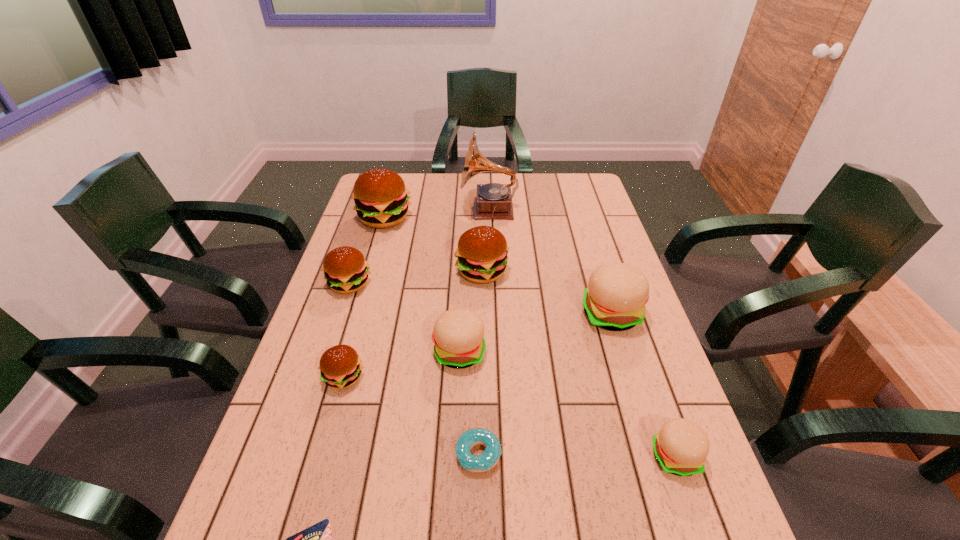
Locate an element on the screen. The image size is (960, 540). the tallest object is located at coordinates (494, 201).

Image resolution: width=960 pixels, height=540 pixels. Find the location of `the farthest hamburger`. the farthest hamburger is located at coordinates 381,201.

At what (x,y) coordinates should I click in order to perform the action: click on the biggest brown hamburger. Please return your answer as a coordinate pair (x, y). The height and width of the screenshot is (540, 960). Looking at the image, I should click on (381, 201).

You are a GUI agent. You are given a task and a screenshot of the screen. Output one action in this format:
    pyautogui.click(x=<x>, y=<y>)
    Task: Click on the rightmost brown hamburger
    This screenshot has width=960, height=540.
    Given the screenshot: What is the action you would take?
    pyautogui.click(x=482, y=252)

Find the location of a particular element. This screenshot has width=960, height=540. the biggest beige hamburger is located at coordinates (615, 298).

This screenshot has width=960, height=540. In order to click on the second smallest brown hamburger in this screenshot , I will do `click(346, 271)`.

Locate an element on the screen. Image resolution: width=960 pixels, height=540 pixels. the leftmost beige hamburger is located at coordinates (458, 336).

Locate an element on the screen. The image size is (960, 540). the nearest brown hamburger is located at coordinates (340, 366).

What are the coordinates of `the nearest hamburger` in the screenshot? It's located at (681, 447).

You are a GUI agent. You are given a task and a screenshot of the screen. Output one action in this format:
    pyautogui.click(x=<x>, y=<y>)
    Task: Click on the nearest beige hamburger
    This screenshot has width=960, height=540.
    Given the screenshot: What is the action you would take?
    pyautogui.click(x=681, y=447)